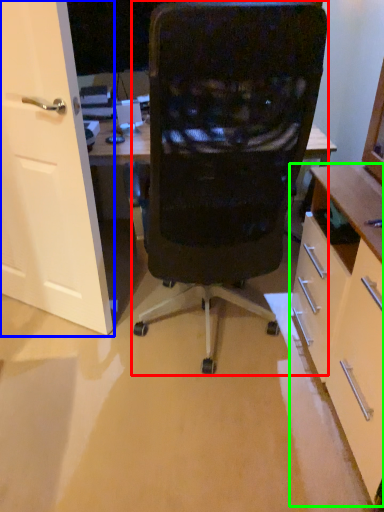
Question: Based on their relative distances, which object is farther from chair (highlighted by a red box)? Choose from door (highlighted by a blue box) and cabinetry (highlighted by a green box).

Choices:
 (A) door
 (B) cabinetry

Answer: (A)